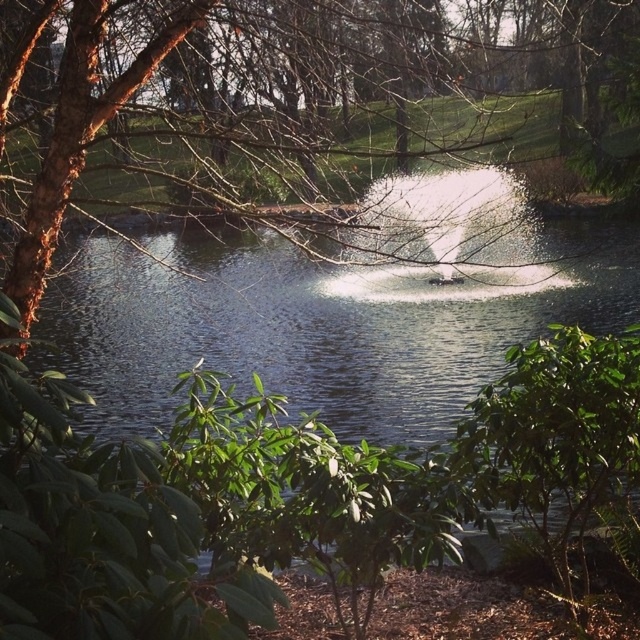
Question: Can you confirm if brown rough bark tree at upper left is wider than clear water at center?

Choices:
 (A) yes
 (B) no

Answer: (B)

Question: Which of the following is the closest to the observer?

Choices:
 (A) clear water at center
 (B) brown rough bark tree at upper left

Answer: (B)

Question: Is brown rough bark tree at upper left closer to camera compared to clear water at center?

Choices:
 (A) no
 (B) yes

Answer: (B)

Question: Which object appears farthest from the camera in this image?

Choices:
 (A) brown rough bark tree at upper left
 (B) clear water at center

Answer: (B)

Question: Is the position of brown rough bark tree at upper left less distant than that of clear water at center?

Choices:
 (A) yes
 (B) no

Answer: (A)